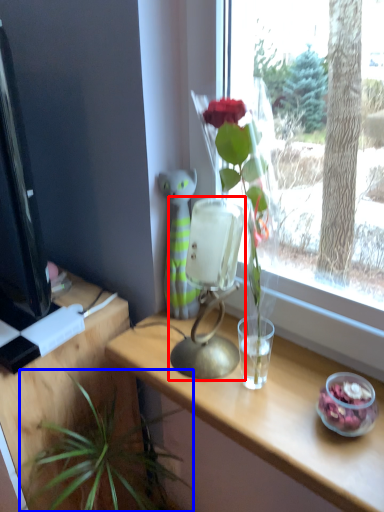
Question: Which object appears farthest to the camera in this image, table lamp (highlighted by a red box) or houseplant (highlighted by a blue box)?

Choices:
 (A) table lamp
 (B) houseplant

Answer: (A)